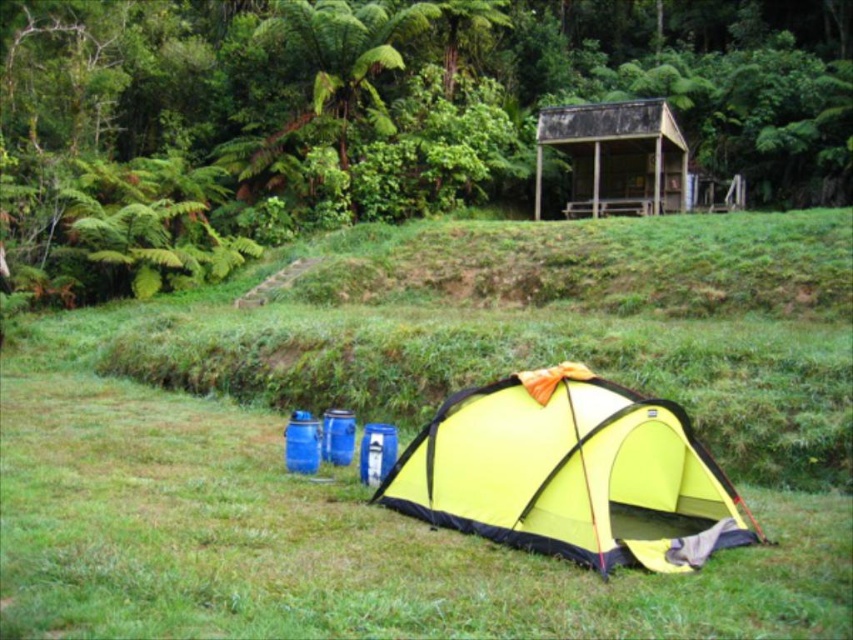
Looking at this image, is yellow fabric tent at lower center positioned behind weathered wood hut at upper center?

No.

Does point (515, 524) come in front of point (585, 115)?

Yes.

Identify the location of yellow fabric tent at lower center. (570, 474).

Is green grassy at lower center taller than weathered wood hut at upper center?

Indeed, green grassy at lower center has a greater height compared to weathered wood hut at upper center.

Which is more to the left, green grassy at lower center or weathered wood hut at upper center?

Positioned to the left is green grassy at lower center.

Is point (554, 596) closer to camera compared to point (585, 106)?

Yes, point (554, 596) is closer to viewer.

This screenshot has width=853, height=640. Find the location of `green grassy at lower center`. green grassy at lower center is located at coordinates (418, 428).

From the picture: Can you confirm if green grassy at lower center is positioned to the right of yellow fabric tent at lower center?

Incorrect, green grassy at lower center is not on the right side of yellow fabric tent at lower center.

Between green grassy at lower center and yellow fabric tent at lower center, which one appears on the left side from the viewer's perspective?

From the viewer's perspective, green grassy at lower center appears more on the left side.

Find the location of a particular element. green grassy at lower center is located at coordinates (418, 428).

This screenshot has width=853, height=640. What are the coordinates of `green grassy at lower center` in the screenshot? It's located at tap(418, 428).